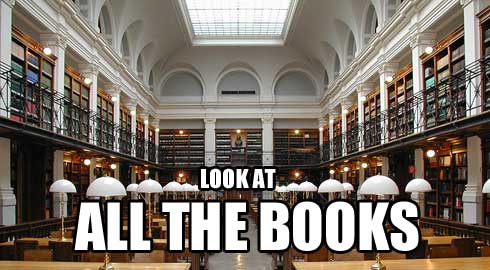
Identify the location of light shining on floor. The width and height of the screenshot is (490, 270). (238, 256), (238, 261).